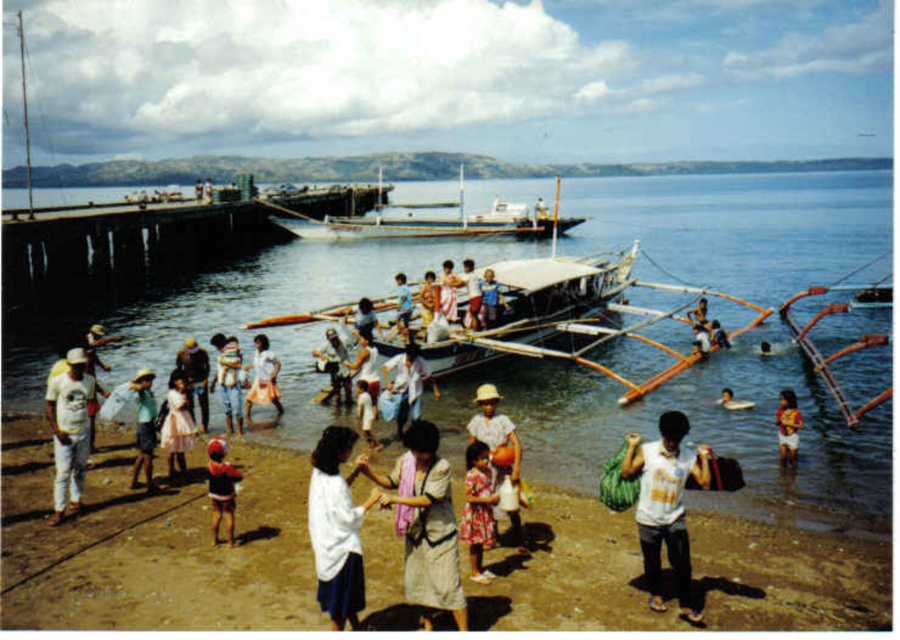
From the picture: You are a photographer standing at the edge of the pier, and you want to capture a photo of the white cotton shirt at lower left and light blue denim shorts at center. Which one is positioned to the left of the other?

The white cotton shirt at lower left is positioned to the left of light blue denim shorts at center.

You are a photographer standing on the wooden planks boat at center and want to take a photo of the light beige cotton dress at center. Can you see the dress from your current position?

The light beige cotton dress at center is below the wooden planks boat at center, so yes, you can see the dress from your position on the boat.